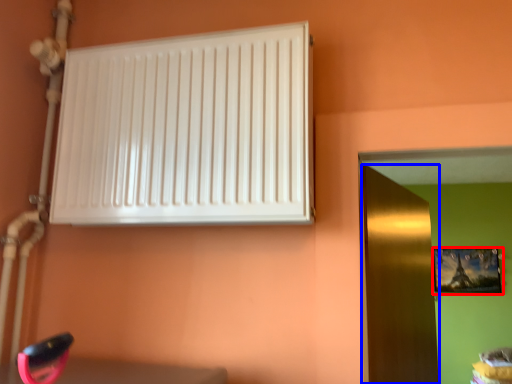
Question: Which object is further to the camera taking this photo, picture frame (highlighted by a red box) or door (highlighted by a blue box)?

Choices:
 (A) picture frame
 (B) door

Answer: (A)